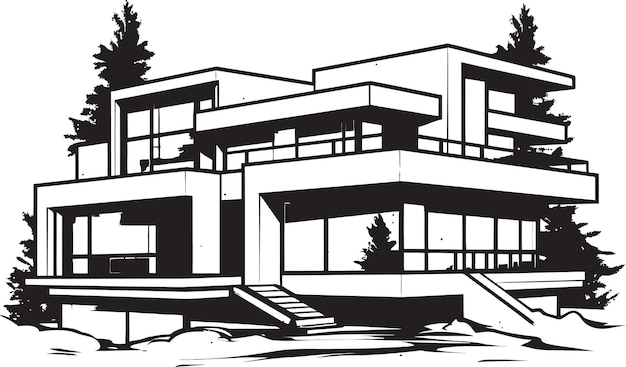
You are a GUI agent. You are given a task and a screenshot of the screen. Output one action in this format:
    pyautogui.click(x=<x>, y=<y>)
    Task: Click on the square and rectangular walls
    This screenshot has height=367, width=626.
    Given the screenshot: What is the action you would take?
    pyautogui.click(x=80, y=196), pyautogui.click(x=347, y=181), pyautogui.click(x=310, y=96), pyautogui.click(x=409, y=69), pyautogui.click(x=191, y=79)